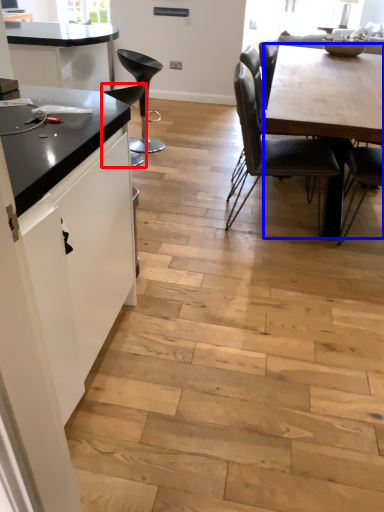
Question: Which object appears closest to the camera in this image, chair (highlighted by a red box) or table (highlighted by a blue box)?

Choices:
 (A) chair
 (B) table

Answer: (B)